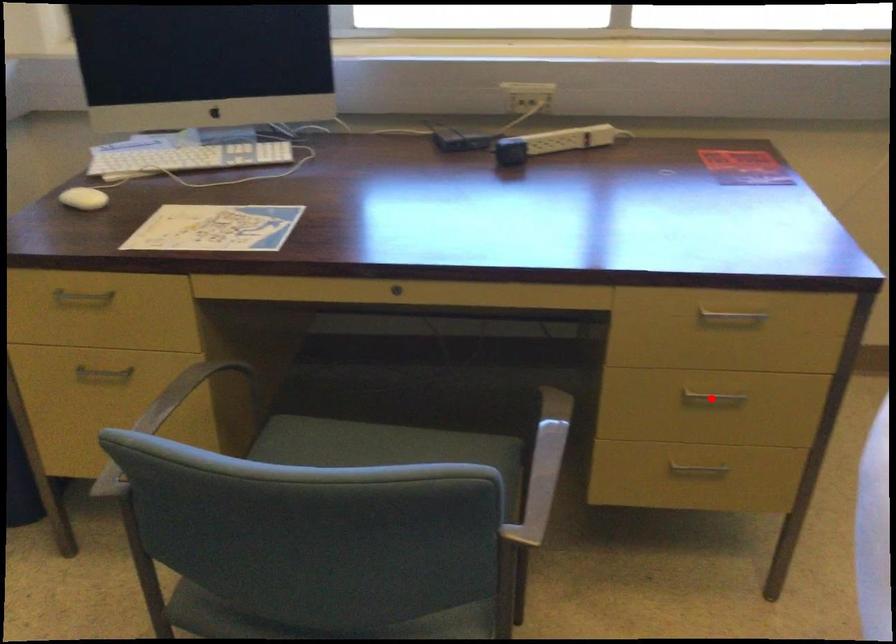
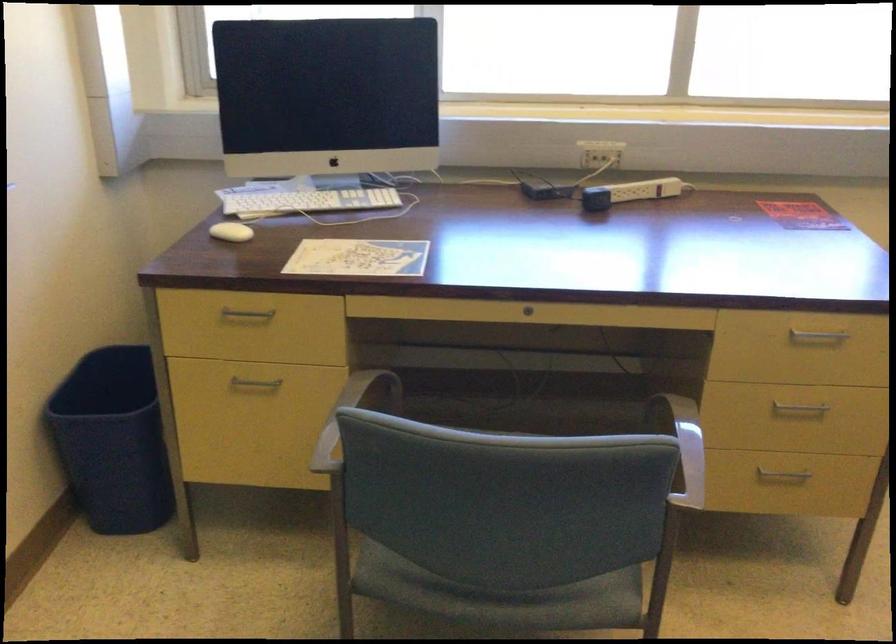
Question: I am providing you with two images of the same scene from different viewpoints. A red point is shown in image1. For the corresponding object point in image2, is it positioned nearer or farther from the camera?

Choices:
 (A) Nearer
 (B) Farther

Answer: (B)